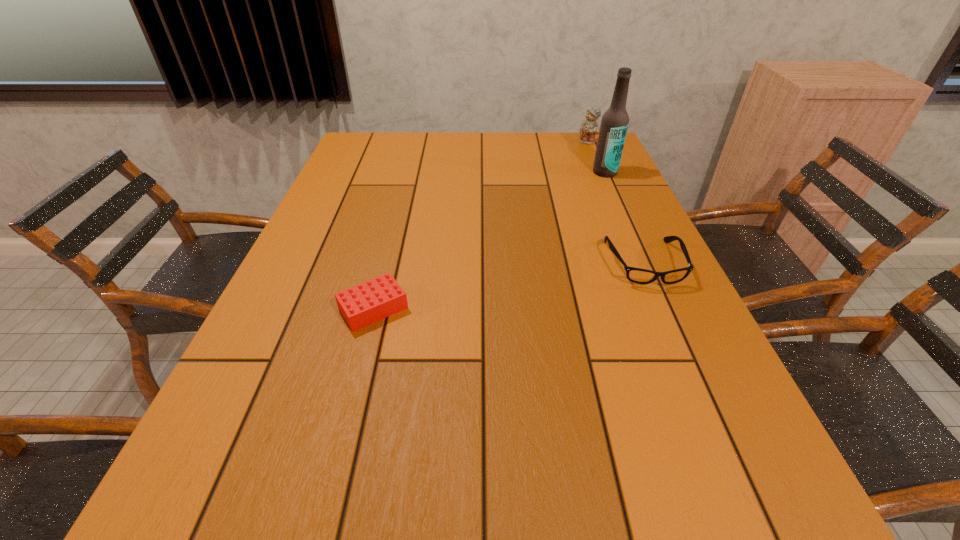
The height and width of the screenshot is (540, 960). In the image, there is a desktop. What are the coordinates of `vacant space at the far edge` in the screenshot? It's located at (548, 155).

Image resolution: width=960 pixels, height=540 pixels. What are the coordinates of `vacant space at the near edge of the desktop` in the screenshot? It's located at (313, 449).

In the image, there is a desktop. At what (x,y) coordinates should I click in order to perform the action: click on vacant region at the left edge. Please return your answer as a coordinate pair (x, y). This screenshot has width=960, height=540. Looking at the image, I should click on (333, 274).

The image size is (960, 540). I want to click on vacant area at the right edge of the desktop, so click(619, 294).

Image resolution: width=960 pixels, height=540 pixels. Find the location of `free space between the spectacles and the leftmost object`. free space between the spectacles and the leftmost object is located at coordinates (509, 286).

The image size is (960, 540). I want to click on vacant area that lies between the second farthest object and the Lego, so click(x=490, y=240).

At what (x,y) coordinates should I click in order to perform the action: click on free space between the leftmost object and the tallest object. Please return your answer as a coordinate pair (x, y). Looking at the image, I should click on (490, 240).

Locate an element on the screen. The width and height of the screenshot is (960, 540). free spot between the spectacles and the beer bottle is located at coordinates (625, 218).

Find the location of a particular element. vacant space in between the leftmost object and the tallest object is located at coordinates (490, 240).

The height and width of the screenshot is (540, 960). Identify the location of vacant space that is in between the spectacles and the third shortest object. (615, 202).